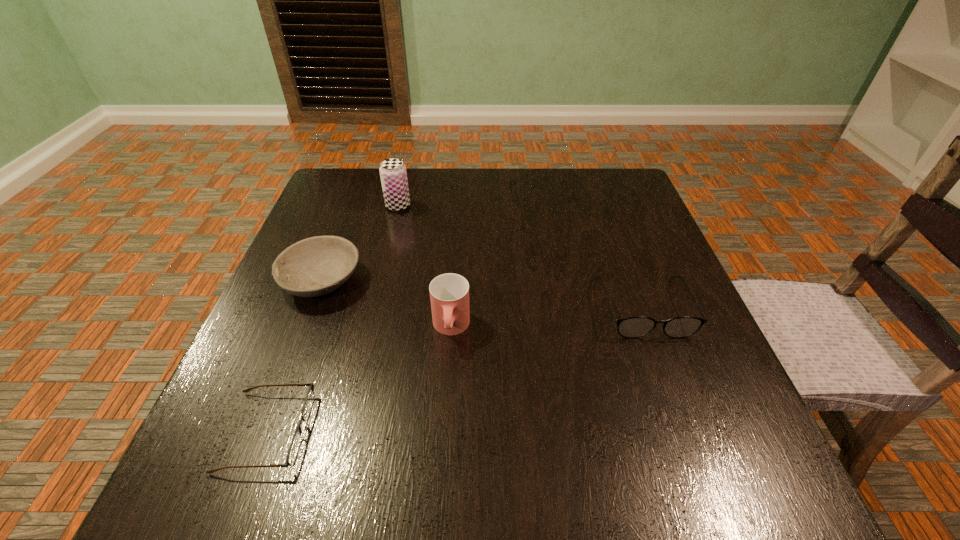
What are the coordinates of `blank region between the nearer spectacles and the second tallest object` in the screenshot? It's located at (359, 379).

The height and width of the screenshot is (540, 960). Identify the location of vacant region between the bowl and the beer can. tap(360, 243).

Find the location of `vacant space that's between the beer can and the taller spectacles`. vacant space that's between the beer can and the taller spectacles is located at coordinates (520, 256).

Find the location of a particular element. vacant area between the farthest object and the bowl is located at coordinates [360, 243].

The image size is (960, 540). Identify the location of free point between the farther spectacles and the nearest object. (455, 369).

Locate an element on the screen. the third closest object to the nearer spectacles is located at coordinates click(x=393, y=174).

Identify which object is the third nearest to the nearest object. Please provide its 2D coordinates. Your answer should be formatted as a tuple, i.e. [(x, y)], where the tuple contains the x and y coordinates of a point satisfying the conditions above.

[(393, 174)]

I want to click on vacant space that satisfies the following two spatial constraints: 1. on the front-facing side of the taller spectacles; 2. on the front-facing side of the shortest object, so click(689, 431).

In order to click on free spot that satisfies the following two spatial constraints: 1. on the side of the cup with the handle; 2. on the front-facing side of the nearer spectacles in this screenshot , I will do `click(444, 431)`.

Where is `vacant area that satisfies the following two spatial constraints: 1. on the side of the fourth object from left to right with the handle; 2. on the front-facing side of the nearer spectacles`? vacant area that satisfies the following two spatial constraints: 1. on the side of the fourth object from left to right with the handle; 2. on the front-facing side of the nearer spectacles is located at coordinates (444, 431).